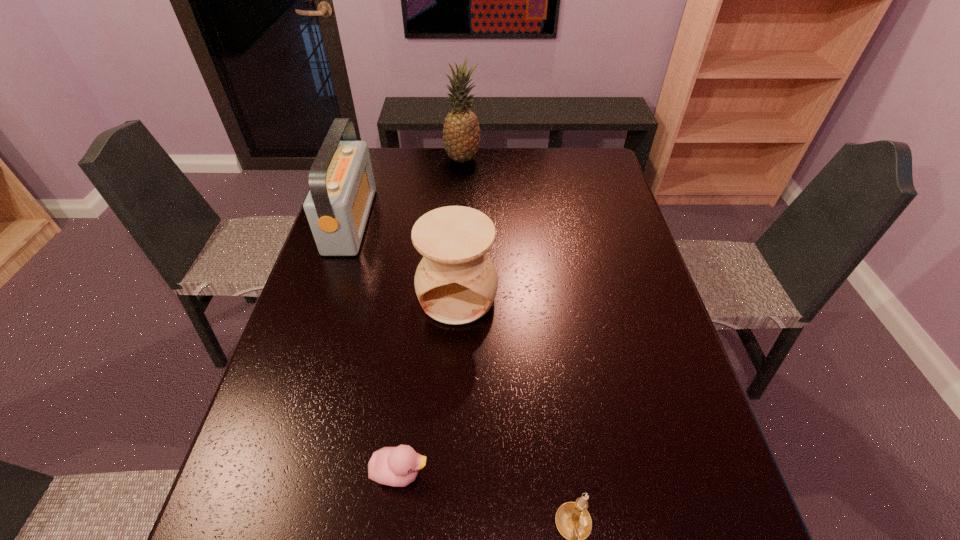
The image size is (960, 540). In order to click on the farthest object in this screenshot , I will do `click(461, 133)`.

Identify the location of the tallest object. The width and height of the screenshot is (960, 540). (461, 133).

Find the location of a particular element. Image resolution: width=960 pixels, height=540 pixels. radio receiver is located at coordinates (342, 187).

Locate an element on the screen. The width and height of the screenshot is (960, 540). the fourth shortest object is located at coordinates (342, 187).

Where is `the third tallest object`? The image size is (960, 540). the third tallest object is located at coordinates (456, 282).

This screenshot has height=540, width=960. What are the coordinates of `the third farthest object` in the screenshot? It's located at (456, 282).

This screenshot has width=960, height=540. I want to click on the shortest object, so click(x=398, y=466).

Locate an element on the screen. Image resolution: width=960 pixels, height=540 pixels. the second nearest object is located at coordinates (398, 466).

Locate an element on the screen. free location located on the front of the tallest object is located at coordinates (459, 222).

Identify the location of vacant space located on the front-facing side of the radio receiver. This screenshot has height=540, width=960. (397, 221).